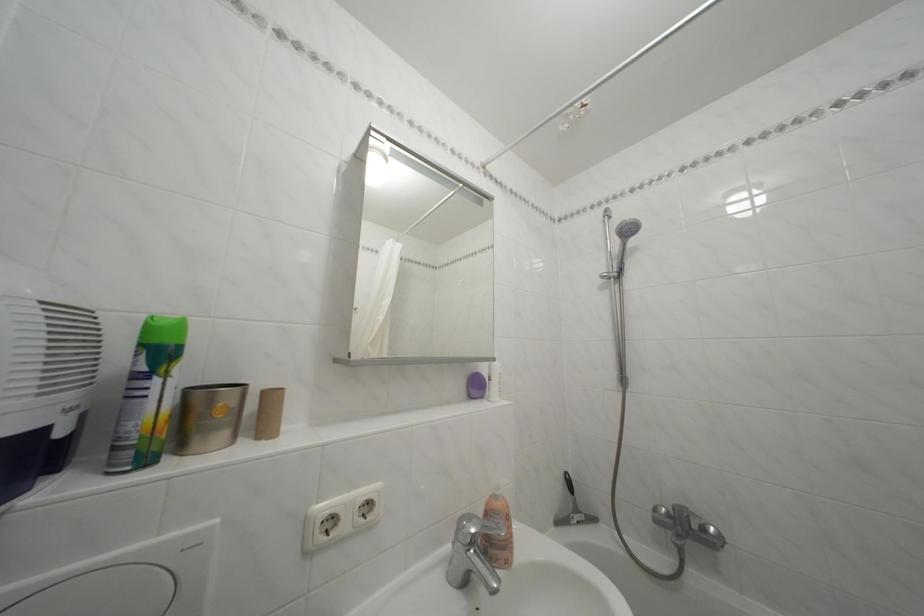
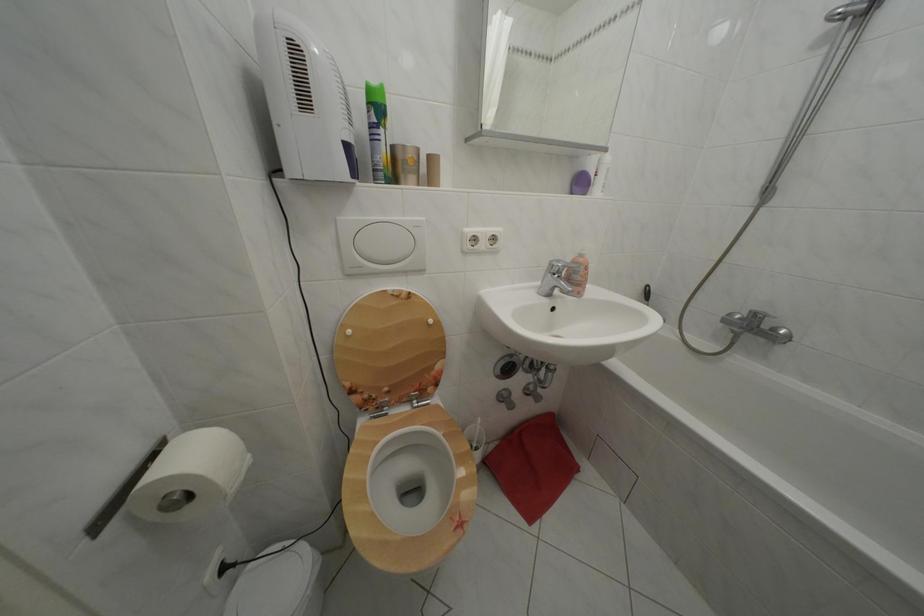
In the second image, find the point that corresponds to point 713,536 in the first image.

(783, 336)